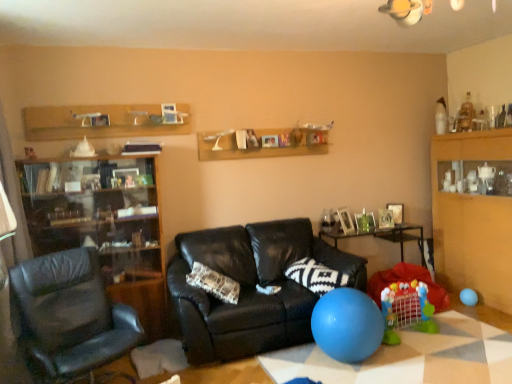
Question: Is wooden shelf at upper center in front of wooden cabinet at right?

Choices:
 (A) yes
 (B) no

Answer: (B)

Question: From a real-world perspective, is wooden shelf at upper center below wooden cabinet at right?

Choices:
 (A) yes
 (B) no

Answer: (B)

Question: From a real-world perspective, is wooden shelf at upper center on top of wooden cabinet at right?

Choices:
 (A) no
 (B) yes

Answer: (B)

Question: Considering the relative sizes of wooden shelf at upper center and wooden cabinet at right in the image provided, is wooden shelf at upper center shorter than wooden cabinet at right?

Choices:
 (A) no
 (B) yes

Answer: (B)

Question: Is wooden shelf at upper center positioned far away from wooden cabinet at right?

Choices:
 (A) no
 (B) yes

Answer: (B)

Question: Is point (293, 374) positioned closer to the camera than point (462, 291)?

Choices:
 (A) closer
 (B) farther

Answer: (A)

Question: In terms of width, does blue rubber ball at lower center, the first table from the front, look wider or thinner when compared to blue rubber balloon at lower right, which is the 2th balloon in front-to-back order?

Choices:
 (A) wide
 (B) thin

Answer: (A)

Question: Visually, is blue rubber ball at lower center, which is counted as the second table, starting from the back, positioned to the left or to the right of blue rubber balloon at lower right, positioned as the 1th balloon in back-to-front order?

Choices:
 (A) left
 (B) right

Answer: (A)

Question: From a real-world perspective, is blue rubber ball at lower center, which is counted as the second table, starting from the back, positioned above or below blue rubber balloon at lower right, the 1th balloon in the right-to-left sequence?

Choices:
 (A) below
 (B) above

Answer: (A)

Question: Considering their positions, is blue rubber balloon at lower right, placed as the second balloon when sorted from left to right, located in front of or behind wooden shelf at upper center?

Choices:
 (A) front
 (B) behind

Answer: (B)

Question: From a real-world perspective, is blue rubber balloon at lower right, positioned as the 1th balloon in back-to-front order, above or below wooden shelf at upper center?

Choices:
 (A) above
 (B) below

Answer: (B)

Question: Based on their sizes in the image, would you say blue rubber balloon at lower right, placed as the second balloon when sorted from left to right, is bigger or smaller than wooden shelf at upper center?

Choices:
 (A) big
 (B) small

Answer: (B)

Question: From the image's perspective, is blue rubber balloon at lower right, which is the 2th balloon in front-to-back order, above or below wooden shelf at upper center?

Choices:
 (A) above
 (B) below

Answer: (B)

Question: In terms of height, does black leather couch at center look taller or shorter compared to blue rubber balloon at lower right, placed as the second balloon when sorted from left to right?

Choices:
 (A) tall
 (B) short

Answer: (A)

Question: Is black leather couch at center inside the boundaries of blue rubber balloon at lower right, placed as the second balloon when sorted from left to right, or outside?

Choices:
 (A) outside
 (B) inside

Answer: (A)